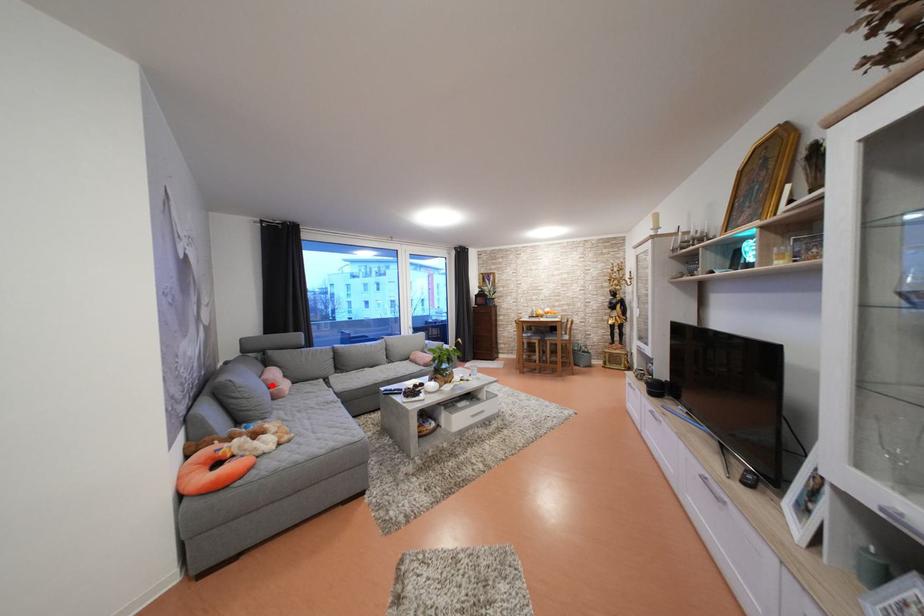
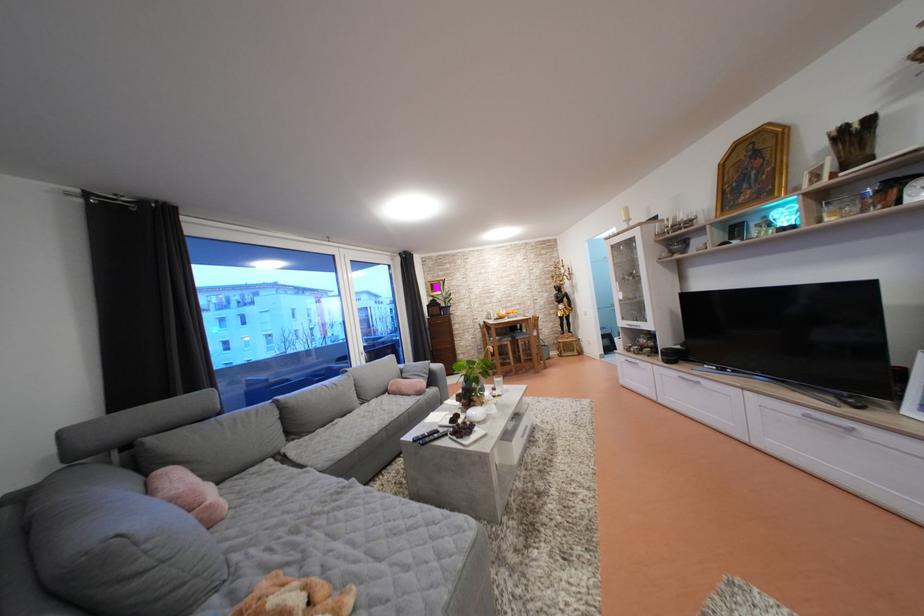
Question: I am providing you with two images of the same scene from different viewpoints. Given a red point in image1, look at the same physical point in image2. Is it:

Choices:
 (A) Closer to the viewpoint
 (B) Farther from the viewpoint

Answer: (B)